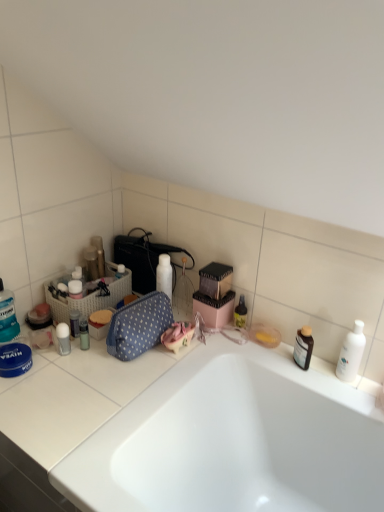
Identify the location of free space in front of metallic silver container at left, positioned as the sixth toiletry in right-to-left order. The image size is (384, 512). (69, 382).